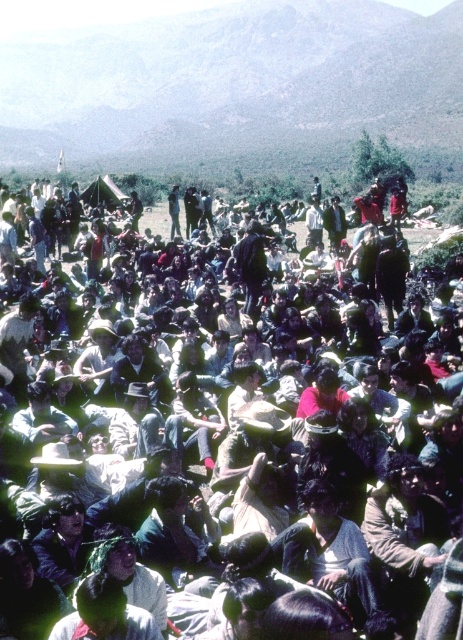
Question: Can you confirm if green grassy hillside at upper center is wider than dark clothing crowd at center?

Choices:
 (A) no
 (B) yes

Answer: (B)

Question: Among these points, which one is nearest to the camera?

Choices:
 (A) (326, 90)
 (B) (393, 438)

Answer: (B)

Question: Among these points, which one is nearest to the camera?

Choices:
 (A) 150,19
 (B) 420,588

Answer: (B)

Question: Does green grassy hillside at upper center have a greater width compared to dark clothing crowd at center?

Choices:
 (A) no
 (B) yes

Answer: (B)

Question: Is green grassy hillside at upper center positioned at the back of dark clothing crowd at center?

Choices:
 (A) yes
 (B) no

Answer: (A)